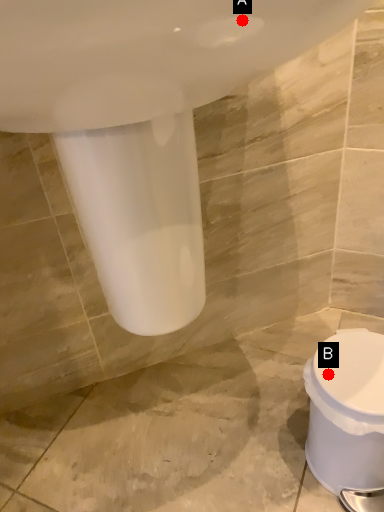
Question: Two points are circled on the image, labeled by A and B beside each circle. Which point is further to the camera?

Choices:
 (A) A is further
 (B) B is further

Answer: (B)